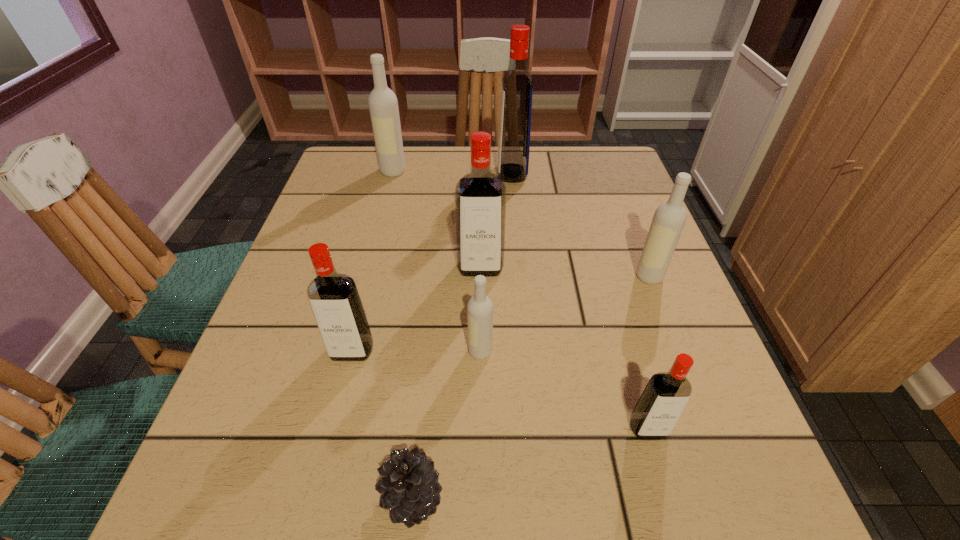
At what (x,y) coordinates should I click in order to perform the action: click on the tallest vodka. Please return your answer as a coordinate pair (x, y). Looking at the image, I should click on (517, 86).

Where is `the tallest object`? This screenshot has height=540, width=960. the tallest object is located at coordinates (517, 86).

The width and height of the screenshot is (960, 540). Find the location of `the biggest white vodka`. the biggest white vodka is located at coordinates (383, 105).

Find the location of a particular element. Image resolution: width=960 pixels, height=540 pixels. the leftmost white vodka is located at coordinates (383, 105).

Find the location of a particular element. the second biggest red vodka is located at coordinates (480, 196).

Locate an element on the screen. the second nearest white vodka is located at coordinates (669, 219).

Locate an element on the screen. the rightmost white vodka is located at coordinates (669, 219).

You are a GUI agent. You are given a task and a screenshot of the screen. Output one action in this format:
    pyautogui.click(x=<x>, y=<y>)
    Task: Click on the leftmost red vodka
    The width and height of the screenshot is (960, 540).
    Given the screenshot: What is the action you would take?
    pyautogui.click(x=334, y=299)

Locate an element on the screen. the second nearest red vodka is located at coordinates (334, 299).

Where is `the rightmost red vodka`? the rightmost red vodka is located at coordinates (659, 407).